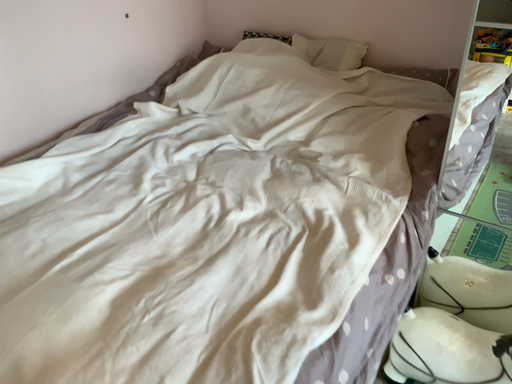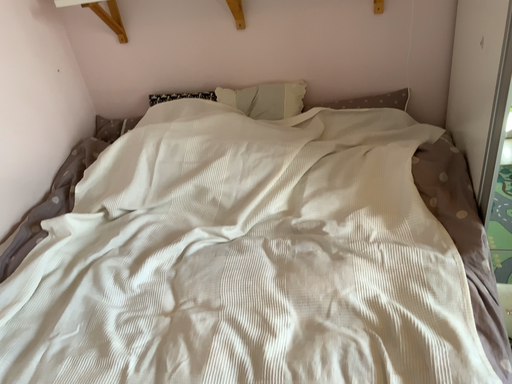
Question: Which way did the camera rotate in the video?

Choices:
 (A) rotated upward
 (B) rotated downward

Answer: (A)